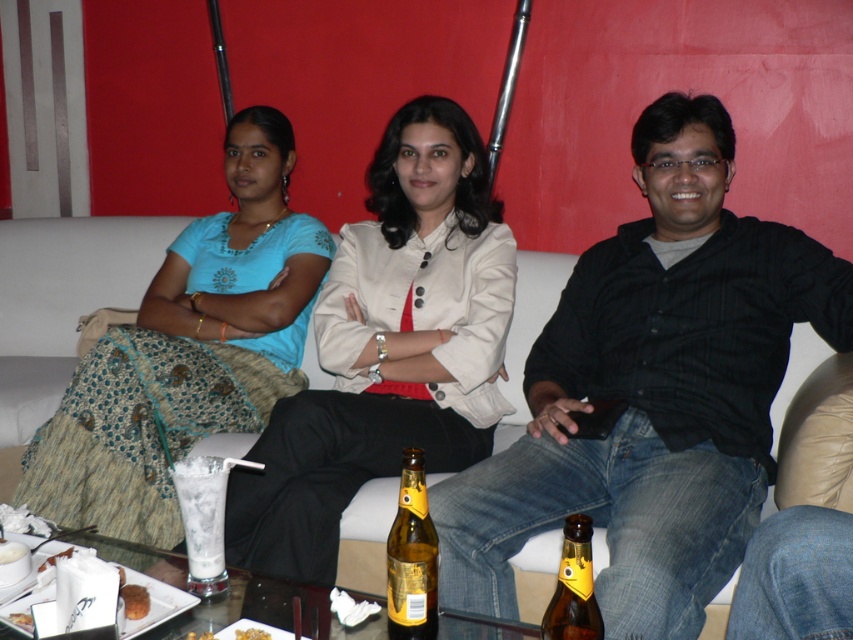
You are a delivery person who needs to place a small package between the matte beige blazer at center and the brown glass bottle at center. Can you fit the package there if it measures 12 inches in length?

The distance between the matte beige blazer at center and the brown glass bottle at center is 31.61 inches. Since the package is only 12 inches long, there is enough space to place it between them.

Based on the scene description, which object is bigger between the matte beige blazer at center and the brown glass bottle at center?

The matte beige blazer at center is larger in size than the brown glass bottle at center according to the description.

Looking at this image, based on the provided scene description, what object is located at the coordinates point (189, 352)?

The object at point (189, 352) is the matte blue blouse at center.